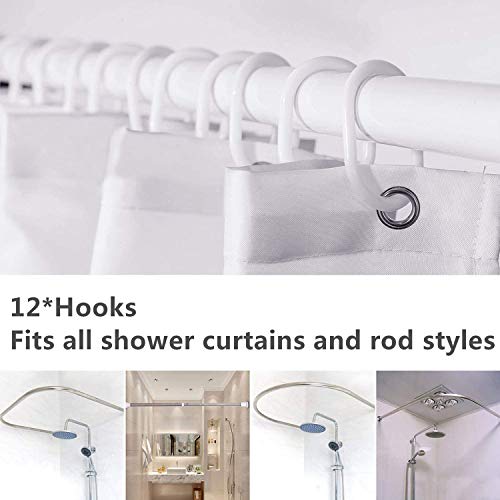
Locate an element on the screen. The height and width of the screenshot is (500, 500). hook is located at coordinates (199, 118).